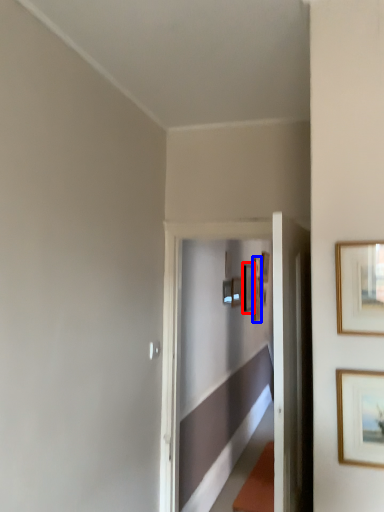
Question: Which point is further to the camera, picture frame (highlighted by a red box) or picture frame (highlighted by a blue box)?

Choices:
 (A) picture frame
 (B) picture frame

Answer: (B)